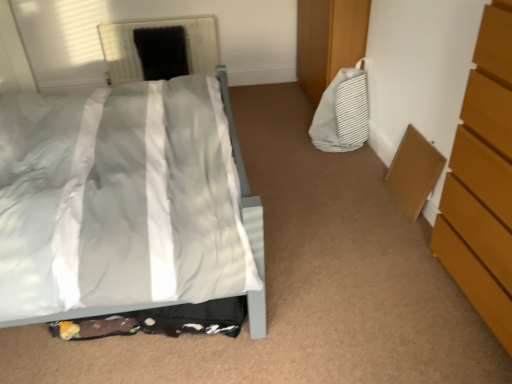
Question: Is wooden chest of drawers at right facing towards white striped fabric bag at right?

Choices:
 (A) yes
 (B) no

Answer: (B)

Question: Considering the relative sizes of wooden chest of drawers at right and white striped fabric bag at right in the image provided, is wooden chest of drawers at right taller than white striped fabric bag at right?

Choices:
 (A) no
 (B) yes

Answer: (B)

Question: Is wooden chest of drawers at right outside white striped fabric bag at right?

Choices:
 (A) yes
 (B) no

Answer: (A)

Question: Is the depth of wooden chest of drawers at right less than that of white striped fabric bag at right?

Choices:
 (A) no
 (B) yes

Answer: (B)

Question: Is wooden chest of drawers at right far away from white striped fabric bag at right?

Choices:
 (A) no
 (B) yes

Answer: (B)

Question: Considering the positions of black matte screen door at upper center and wooden chest of drawers at right in the image, is black matte screen door at upper center wider or thinner than wooden chest of drawers at right?

Choices:
 (A) wide
 (B) thin

Answer: (B)

Question: From the image's perspective, relative to wooden chest of drawers at right, is black matte screen door at upper center above or below?

Choices:
 (A) below
 (B) above

Answer: (B)

Question: Considering the positions of black matte screen door at upper center and wooden chest of drawers at right in the image, is black matte screen door at upper center bigger or smaller than wooden chest of drawers at right?

Choices:
 (A) big
 (B) small

Answer: (B)

Question: Based on their positions, is black matte screen door at upper center located to the left or right of wooden chest of drawers at right?

Choices:
 (A) right
 (B) left

Answer: (B)

Question: Which is correct: white striped fabric bag at right is inside black matte screen door at upper center, or outside of it?

Choices:
 (A) outside
 (B) inside

Answer: (A)

Question: From the image's perspective, relative to black matte screen door at upper center, is white striped fabric bag at right above or below?

Choices:
 (A) above
 (B) below

Answer: (B)

Question: Would you say white striped fabric bag at right is to the left or to the right of black matte screen door at upper center in the picture?

Choices:
 (A) right
 (B) left

Answer: (A)

Question: Is white striped fabric bag at right wider or thinner than black matte screen door at upper center?

Choices:
 (A) wide
 (B) thin

Answer: (A)

Question: Considering the positions of white glossy bed at center and white striped fabric bag at right in the image, is white glossy bed at center bigger or smaller than white striped fabric bag at right?

Choices:
 (A) small
 (B) big

Answer: (B)

Question: Based on their positions, is white glossy bed at center located to the left or right of white striped fabric bag at right?

Choices:
 (A) right
 (B) left

Answer: (B)